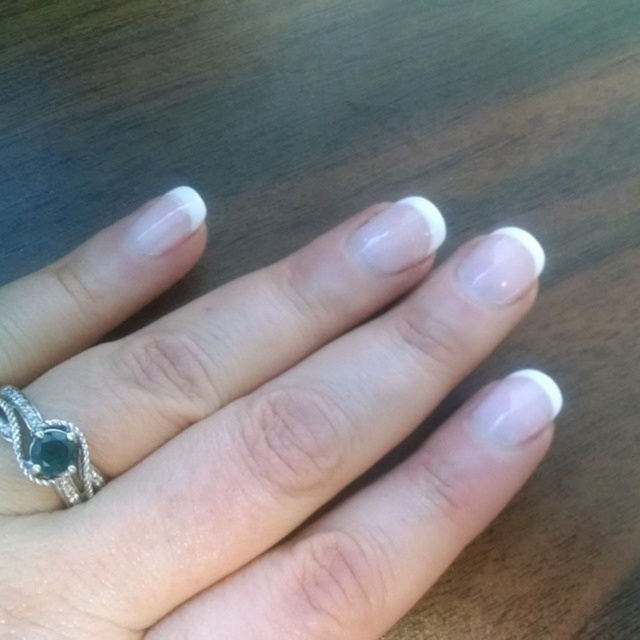
Question: Which of the following is the farthest from the observer?

Choices:
 (A) (64, 477)
 (B) (448, 522)

Answer: (B)

Question: Among these points, which one is farthest from the camera?

Choices:
 (A) (396, 602)
 (B) (13, 416)

Answer: (A)

Question: Which point is closer to the camera?

Choices:
 (A) polished silver ring with green gemstone at center
 (B) white glossy nails at center

Answer: (B)

Question: Can you confirm if white glossy nails at center is wider than polished silver ring with green gemstone at center?

Choices:
 (A) yes
 (B) no

Answer: (A)

Question: Considering the relative positions of white glossy nails at center and polished silver ring with green gemstone at center in the image provided, where is white glossy nails at center located with respect to polished silver ring with green gemstone at center?

Choices:
 (A) above
 (B) below

Answer: (A)

Question: Does white glossy nails at center lie in front of polished silver ring with green gemstone at center?

Choices:
 (A) no
 (B) yes

Answer: (B)